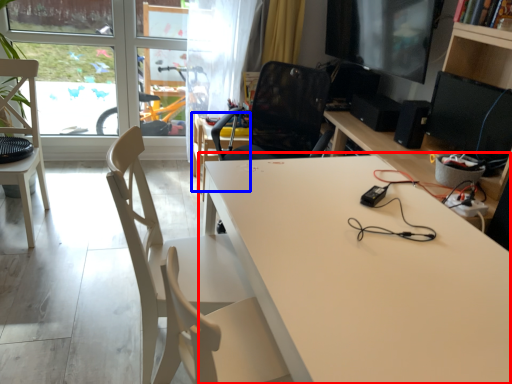
Question: Which object appears closest to the camera in this image, table (highlighted by a red box) or table (highlighted by a blue box)?

Choices:
 (A) table
 (B) table

Answer: (A)